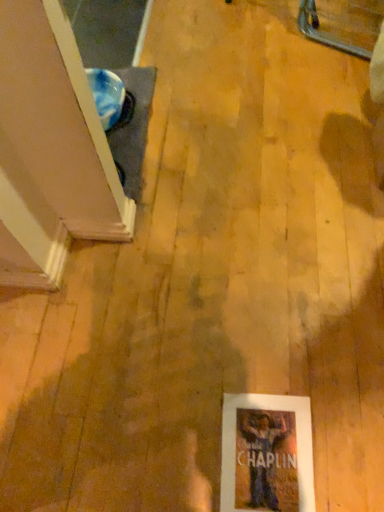
Where is `free point above white paper poster at lower center (from a real-world perspective)`? free point above white paper poster at lower center (from a real-world perspective) is located at coordinates (262, 457).